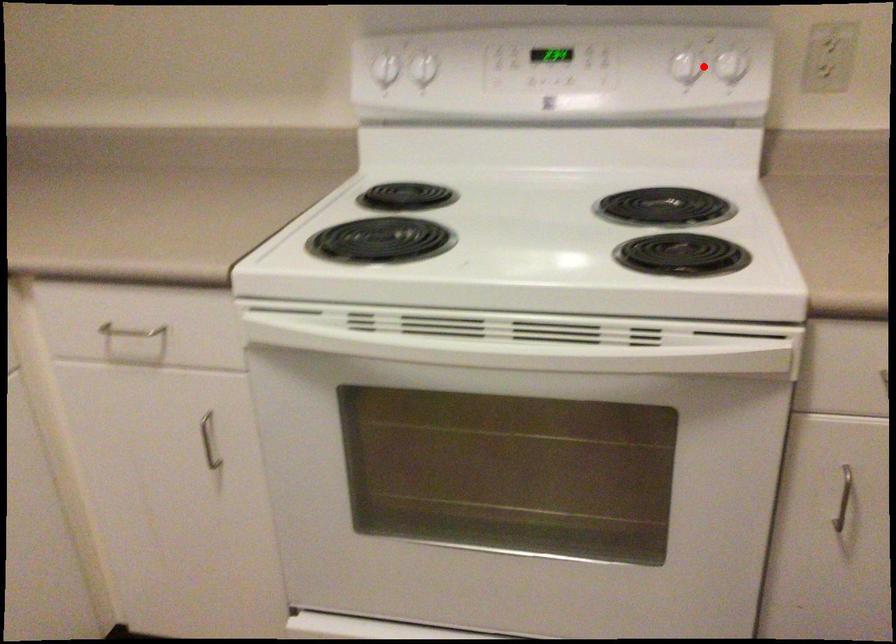
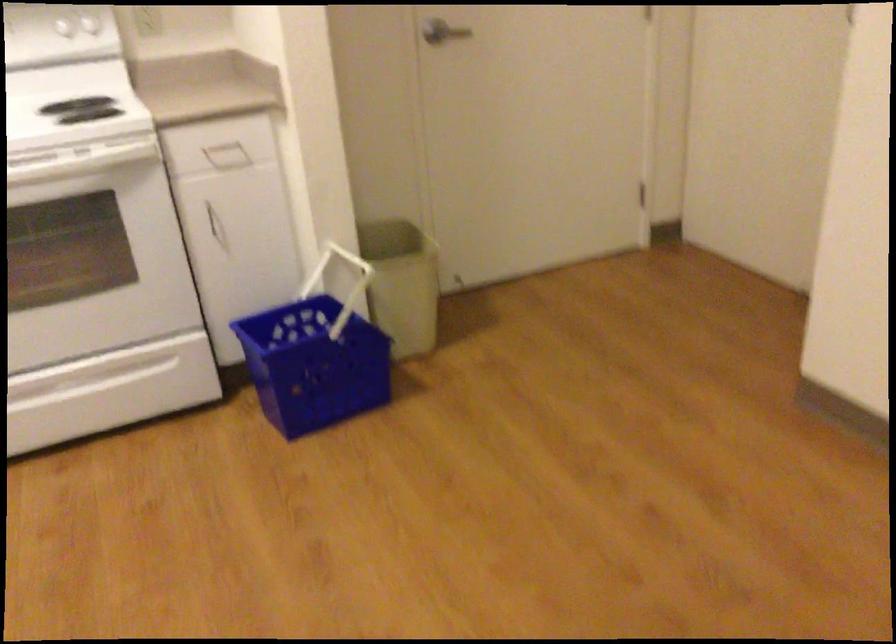
Question: I am providing you with two images of the same scene from different viewpoints. Given a red point in image1, look at the same physical point in image2. Is it:

Choices:
 (A) Closer to the viewpoint
 (B) Farther from the viewpoint

Answer: (B)